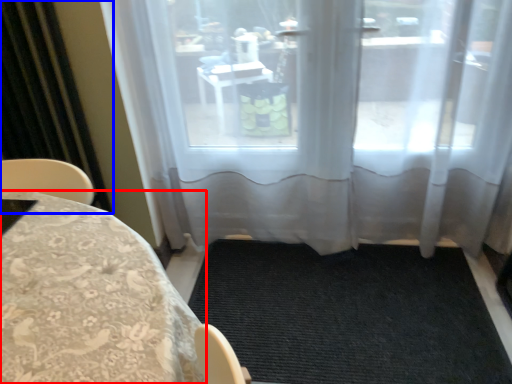
Question: Among these objects, which one is nearest to the camera, furniture (highlighted by a red box) or curtain (highlighted by a blue box)?

Choices:
 (A) furniture
 (B) curtain

Answer: (A)